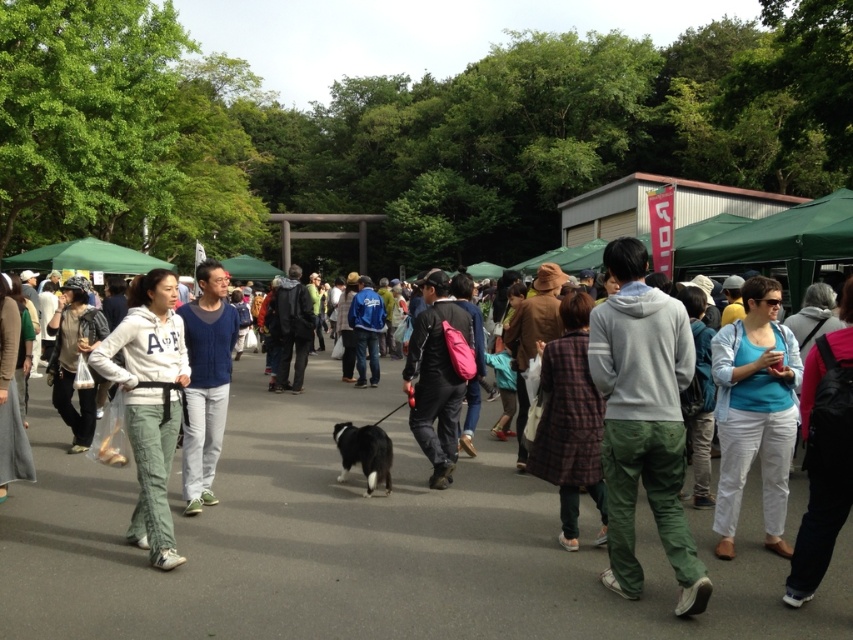
Is white cotton hoodie at center bigger than matte blue sweater at center?

Yes, white cotton hoodie at center is bigger than matte blue sweater at center.

What do you see at coordinates (149, 403) in the screenshot?
I see `white cotton hoodie at center` at bounding box center [149, 403].

The width and height of the screenshot is (853, 640). In order to click on white cotton hoodie at center in this screenshot , I will do `click(149, 403)`.

Does matte blue shirt at center appear under matte blue sweater at center?

Yes.

At what (x,y) coordinates should I click in order to perform the action: click on matte blue shirt at center. Please return your answer as a coordinate pair (x, y). Looking at the image, I should click on (753, 412).

Can you confirm if matte blue sweater at center is taller than pink fabric backpack at center?

Indeed, matte blue sweater at center has a greater height compared to pink fabric backpack at center.

Is matte blue sweater at center thinner than pink fabric backpack at center?

Yes, matte blue sweater at center is thinner than pink fabric backpack at center.

Locate an element on the screen. matte blue sweater at center is located at coordinates (206, 381).

Find the location of `matte blue sweater at center`. matte blue sweater at center is located at coordinates (206, 381).